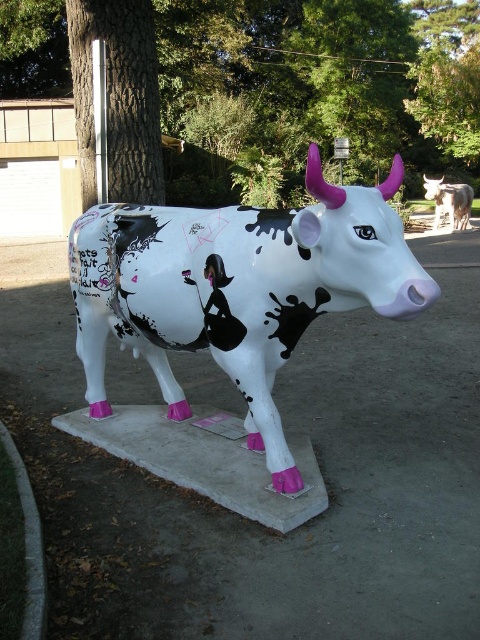
Question: Which object appears closest to the camera in this image?

Choices:
 (A) painted plastic cow at center
 (B) white glossy cow at center

Answer: (A)

Question: Is painted plastic cow at center thinner than white glossy cow at center?

Choices:
 (A) yes
 (B) no

Answer: (B)

Question: Is painted plastic cow at center below white glossy cow at center?

Choices:
 (A) no
 (B) yes

Answer: (B)

Question: Which point is farther to the camera?

Choices:
 (A) painted plastic cow at center
 (B) white glossy cow at center

Answer: (B)

Question: Which point is farther to the camera?

Choices:
 (A) pos(286,348)
 (B) pos(463,216)

Answer: (B)

Question: Observing the image, what is the correct spatial positioning of painted plastic cow at center in reference to white glossy cow at center?

Choices:
 (A) below
 (B) above

Answer: (A)